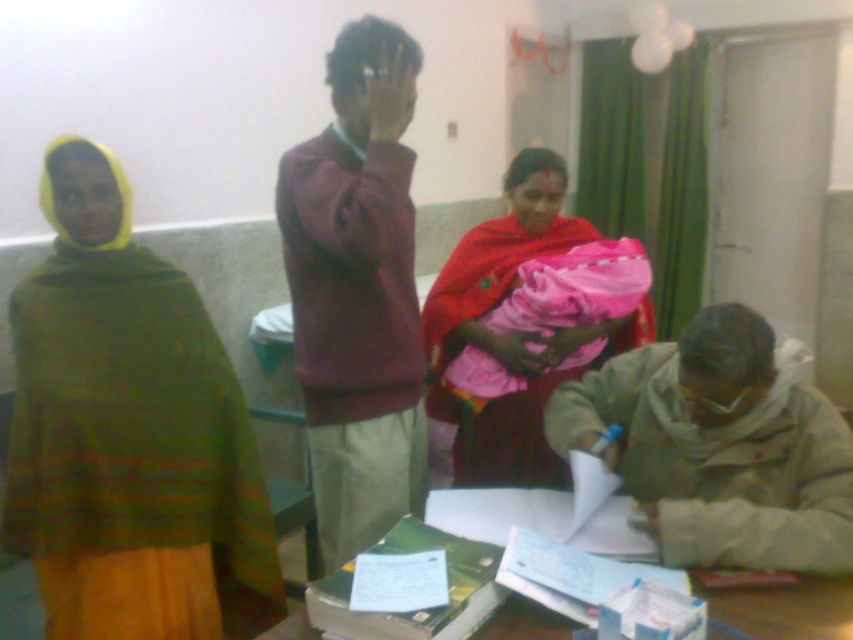
Question: Can you confirm if beige fabric jacket at lower right is bigger than paper-covered table at lower center?

Choices:
 (A) yes
 (B) no

Answer: (A)

Question: Does beige fabric jacket at lower right have a greater width compared to paper-covered table at lower center?

Choices:
 (A) no
 (B) yes

Answer: (B)

Question: Which of the following is the farthest from the observer?

Choices:
 (A) paper-covered table at lower center
 (B) matte red shawl at center
 (C) maroon sweater at center
 (D) green textured shawl at left

Answer: (B)

Question: Considering the real-world distances, which object is closest to the green textured shawl at left?

Choices:
 (A) maroon sweater at center
 (B) paper-covered table at lower center

Answer: (A)

Question: Does green textured shawl at left appear under paper-covered table at lower center?

Choices:
 (A) no
 (B) yes

Answer: (A)

Question: Which point appears farthest from the camera in this image?

Choices:
 (A) (631, 332)
 (B) (352, 477)
 (C) (815, 582)

Answer: (A)